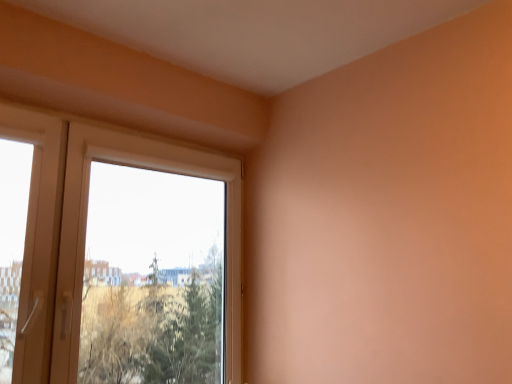
Where is `white glossy door at left`? The width and height of the screenshot is (512, 384). white glossy door at left is located at coordinates (38, 237).

What do you see at coordinates (38, 237) in the screenshot? The image size is (512, 384). I see `white glossy door at left` at bounding box center [38, 237].

This screenshot has height=384, width=512. What do you see at coordinates (85, 232) in the screenshot?
I see `white plastic window at upper left` at bounding box center [85, 232].

I want to click on white plastic window at upper left, so click(85, 232).

The width and height of the screenshot is (512, 384). Find the location of `white glossy door at left`. white glossy door at left is located at coordinates (38, 237).

Is white glossy door at left to the right of white plastic window at upper left from the viewer's perspective?

Incorrect, white glossy door at left is not on the right side of white plastic window at upper left.

Does white glossy door at left lie behind white plastic window at upper left?

No, white glossy door at left is closer to the camera.

Which is more distant, (x=33, y=154) or (x=32, y=217)?

The point (x=33, y=154) is behind.

From the image's perspective, between white glossy door at left and white plastic window at upper left, which one is located above?

white glossy door at left is shown above in the image.

From a real-world perspective, is white glossy door at left positioned under white plastic window at upper left based on gravity?

Actually, white glossy door at left is physically above white plastic window at upper left in the real world.

From the picture: Which object is thinner, white glossy door at left or white plastic window at upper left?

With smaller width is white glossy door at left.

Looking at this image, is white glossy door at left shorter than white plastic window at upper left?

Yes, white glossy door at left is shorter than white plastic window at upper left.

Between white glossy door at left and white plastic window at upper left, which one has smaller size?

With smaller size is white glossy door at left.

Choose the correct answer: Is white glossy door at left inside white plastic window at upper left or outside it?

white glossy door at left is not enclosed by white plastic window at upper left.

Is white glossy door at left not near white plastic window at upper left?

Actually, white glossy door at left and white plastic window at upper left are a little close together.

Is white glossy door at left facing away from white plastic window at upper left?

No, white glossy door at left is not facing the opposite direction of white plastic window at upper left.

How different are the orientations of white glossy door at left and white plastic window at upper left in degrees?

0.000363 degrees.

I want to click on screen door located above the white plastic window at upper left (from the image's perspective), so click(38, 237).

Is white plastic window at upper left to the right of white glossy door at left from the viewer's perspective?

Yes, white plastic window at upper left is to the right of white glossy door at left.

Consider the image. Relative to white glossy door at left, is white plastic window at upper left in front or behind?

Visually, white plastic window at upper left is located behind white glossy door at left.

Which point is more forward, (35, 136) or (6, 104)?

The point (6, 104) is in front.

From the image's perspective, is white plastic window at upper left located above white glossy door at left?

Actually, white plastic window at upper left appears below white glossy door at left in the image.

From a real-world perspective, is white plastic window at upper left above or below white glossy door at left?

In terms of real-world spatial position, white plastic window at upper left is below white glossy door at left.

Considering the relative sizes of white plastic window at upper left and white glossy door at left in the image provided, is white plastic window at upper left thinner than white glossy door at left?

Incorrect, the width of white plastic window at upper left is not less than that of white glossy door at left.

Is white plastic window at upper left shorter than white glossy door at left?

In fact, white plastic window at upper left may be taller than white glossy door at left.

Looking at the image, does white plastic window at upper left seem bigger or smaller compared to white glossy door at left?

Clearly, white plastic window at upper left is larger in size than white glossy door at left.

Is white plastic window at upper left located outside white glossy door at left?

white plastic window at upper left is positioned outside white glossy door at left.

Would you consider white plastic window at upper left to be distant from white glossy door at left?

No, white plastic window at upper left is not far away from white glossy door at left.

Is white plastic window at upper left looking in the opposite direction of white glossy door at left?

No.

Where is `window behind the white glossy door at left`? Image resolution: width=512 pixels, height=384 pixels. window behind the white glossy door at left is located at coordinates tap(85, 232).

I want to click on screen door to the left of white plastic window at upper left, so click(x=38, y=237).

This screenshot has width=512, height=384. I want to click on screen door in front of the white plastic window at upper left, so click(x=38, y=237).